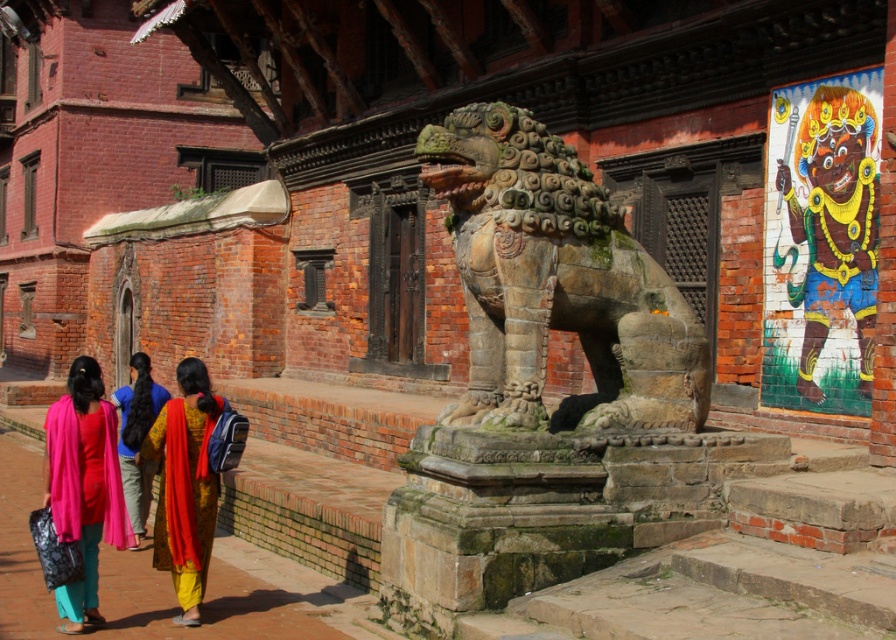
Consider the image. You are a tourist standing in front of the red brick building and want to take a photo of both the green stone lion at center and the multicolored painted deity at upper right. Which direction should you move to ensure both are in your camera frame?

To capture both the green stone lion at center and the multicolored painted deity at upper right in your photo, you should move to the left side of the red brick building. This positioning allows the green stone lion at center, which is to the left of the multicolored painted deity at upper right, to be framed alongside the deity in your camera view.

Looking at this image, you are a tourist visiting this traditional Nepalese street scene. You notice a green stone lion at center and a yellow silk saree at center. Which object is located higher in the image?

The green stone lion at center is positioned over the yellow silk saree at center, so it is higher up in the image.